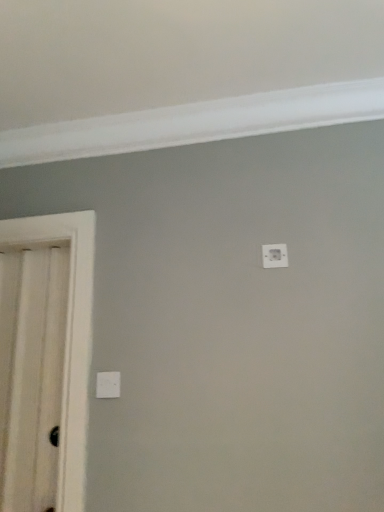
In order to click on white glossy door at left in this screenshot , I will do `click(45, 359)`.

From the picture: What is the approximate width of white plastic light switch at lower center, marked as the 1th light switch in a bottom-to-top arrangement?

→ 0.81 inches.

Image resolution: width=384 pixels, height=512 pixels. What do you see at coordinates (108, 385) in the screenshot?
I see `white plastic light switch at lower center, positioned as the second light switch in right-to-left order` at bounding box center [108, 385].

The width and height of the screenshot is (384, 512). What do you see at coordinates (274, 256) in the screenshot? I see `white plastic light switch at upper center, placed as the second light switch when sorted from left to right` at bounding box center [274, 256].

What are the coordinates of `white glossy door at left` in the screenshot? It's located at (45, 359).

How different are the orientations of white glossy door at left and white plastic light switch at lower center, which ranks as the first light switch in left-to-right order, in degrees?

0.568 degrees.

Between white glossy door at left and white plastic light switch at lower center, which ranks as the first light switch in left-to-right order, which one has larger size?

white glossy door at left is bigger.

From the image's perspective, is white glossy door at left above white plastic light switch at lower center, positioned as the second light switch in right-to-left order?

Yes, from the image's perspective, white glossy door at left is over white plastic light switch at lower center, positioned as the second light switch in right-to-left order.

Is white glossy door at left not close to white plastic light switch at lower center, marked as the 1th light switch in a bottom-to-top arrangement?

No, white glossy door at left is not far away from white plastic light switch at lower center, marked as the 1th light switch in a bottom-to-top arrangement.

Is white plastic light switch at upper center, placed as the second light switch when sorted from left to right, at the back of white glossy door at left?

No, white glossy door at left's orientation is not away from white plastic light switch at upper center, placed as the second light switch when sorted from left to right.

Is white glossy door at left positioned far away from white plastic light switch at upper center, the 1th light switch positioned from the top?

That's not correct — white glossy door at left is a little close to white plastic light switch at upper center, the 1th light switch positioned from the top.

Identify the location of door located on the left of white plastic light switch at upper center, placed as the second light switch when sorted from left to right. (45, 359).

Considering the sizes of white glossy door at left and white plastic light switch at upper center, placed as the second light switch when sorted from left to right, in the image, is white glossy door at left taller or shorter than white plastic light switch at upper center, placed as the second light switch when sorted from left to right,?

In the image, white glossy door at left appears to be taller than white plastic light switch at upper center, placed as the second light switch when sorted from left to right.

Measure the distance from white plastic light switch at lower center, positioned as the second light switch in right-to-left order, to white glossy door at left.

14.57 inches.

What's the angular difference between white plastic light switch at lower center, arranged as the second light switch when viewed from the top, and white glossy door at left's facing directions?

The angular difference between white plastic light switch at lower center, arranged as the second light switch when viewed from the top, and white glossy door at left is 0.568 degrees.

Is white plastic light switch at lower center, arranged as the second light switch when viewed from the top, touching white glossy door at left?

No.

Is white plastic light switch at lower center, marked as the 1th light switch in a bottom-to-top arrangement, positioned with its back to white glossy door at left?

No, white plastic light switch at lower center, marked as the 1th light switch in a bottom-to-top arrangement,'s orientation is not away from white glossy door at left.

Is white plastic light switch at lower center, which ranks as the first light switch in left-to-right order, facing towards white plastic light switch at upper center, the 1th light switch positioned from the top?

No, white plastic light switch at lower center, which ranks as the first light switch in left-to-right order, is not aimed at white plastic light switch at upper center, the 1th light switch positioned from the top.

Which point is more distant from viewer, (99, 398) or (263, 266)?

Point (263, 266)

In the scene shown: Is white plastic light switch at lower center, arranged as the second light switch when viewed from the top, inside the boundaries of white plastic light switch at upper center, the 1th light switch positioned from the top, or outside?

white plastic light switch at lower center, arranged as the second light switch when viewed from the top, lies outside white plastic light switch at upper center, the 1th light switch positioned from the top.

Can you see white plastic light switch at lower center, marked as the 1th light switch in a bottom-to-top arrangement, touching white plastic light switch at upper center, placed as the second light switch when sorted from left to right?

white plastic light switch at lower center, marked as the 1th light switch in a bottom-to-top arrangement, and white plastic light switch at upper center, placed as the second light switch when sorted from left to right, are not in contact.

Which object is positioned more to the left, white plastic light switch at upper center, arranged as the second light switch when ordered from the bottom, or white plastic light switch at lower center, marked as the 1th light switch in a bottom-to-top arrangement?

white plastic light switch at lower center, marked as the 1th light switch in a bottom-to-top arrangement.

I want to click on light switch below the white plastic light switch at upper center, which is counted as the 1th light switch, starting from the right (from a real-world perspective), so click(x=108, y=385).

From the picture: Is white plastic light switch at upper center, which is counted as the 1th light switch, starting from the right, taller or shorter than white plastic light switch at lower center, positioned as the second light switch in right-to-left order?

white plastic light switch at upper center, which is counted as the 1th light switch, starting from the right, is shorter than white plastic light switch at lower center, positioned as the second light switch in right-to-left order.

Can you confirm if white plastic light switch at upper center, placed as the second light switch when sorted from left to right, is bigger than white glossy door at left?

No, white plastic light switch at upper center, placed as the second light switch when sorted from left to right, is not bigger than white glossy door at left.

Is white glossy door at left inside white plastic light switch at upper center, which is counted as the 1th light switch, starting from the right?

No.

The height and width of the screenshot is (512, 384). Find the location of `door below the white plastic light switch at upper center, which is counted as the 1th light switch, starting from the right (from a real-world perspective)`. door below the white plastic light switch at upper center, which is counted as the 1th light switch, starting from the right (from a real-world perspective) is located at coordinates (45, 359).

Is white plastic light switch at upper center, arranged as the second light switch when ordered from the bottom, far from white glossy door at left?

white plastic light switch at upper center, arranged as the second light switch when ordered from the bottom, is actually quite close to white glossy door at left.

Which light switch is the 1st one when counting from the back of the white glossy door at left? Please provide its 2D coordinates.

[(108, 385)]

Where is `the 2nd light switch to the right when counting from the white glossy door at left`? The image size is (384, 512). the 2nd light switch to the right when counting from the white glossy door at left is located at coordinates (274, 256).

Estimate the real-world distances between objects in this image. Which object is closer to white plastic light switch at lower center, which ranks as the first light switch in left-to-right order, white plastic light switch at upper center, arranged as the second light switch when ordered from the bottom, or white glossy door at left?

Among the two, white glossy door at left is located nearer to white plastic light switch at lower center, which ranks as the first light switch in left-to-right order.

Looking at the image, which one is located further to white plastic light switch at upper center, which is counted as the 1th light switch, starting from the right, white plastic light switch at lower center, marked as the 1th light switch in a bottom-to-top arrangement, or white glossy door at left?

white glossy door at left lies further to white plastic light switch at upper center, which is counted as the 1th light switch, starting from the right, than the other object.

Considering their positions, is white glossy door at left positioned closer to white plastic light switch at upper center, placed as the second light switch when sorted from left to right, than white plastic light switch at lower center, positioned as the second light switch in right-to-left order?

white plastic light switch at lower center, positioned as the second light switch in right-to-left order.

When comparing their distances from white glossy door at left, does white plastic light switch at upper center, placed as the second light switch when sorted from left to right, or white plastic light switch at lower center, positioned as the second light switch in right-to-left order, seem closer?

white plastic light switch at lower center, positioned as the second light switch in right-to-left order, lies closer to white glossy door at left than the other object.

From the image, which object appears to be nearer to white plastic light switch at lower center, marked as the 1th light switch in a bottom-to-top arrangement, white glossy door at left or white plastic light switch at upper center, arranged as the second light switch when ordered from the bottom?

white glossy door at left is closer to white plastic light switch at lower center, marked as the 1th light switch in a bottom-to-top arrangement.

Based on their spatial positions, is white plastic light switch at lower center, marked as the 1th light switch in a bottom-to-top arrangement, or white plastic light switch at upper center, placed as the second light switch when sorted from left to right, further from white glossy door at left?

white plastic light switch at upper center, placed as the second light switch when sorted from left to right.

Where is `light switch located between white glossy door at left and white plastic light switch at upper center, the 1th light switch positioned from the top, in the left-right direction`? light switch located between white glossy door at left and white plastic light switch at upper center, the 1th light switch positioned from the top, in the left-right direction is located at coordinates (108, 385).